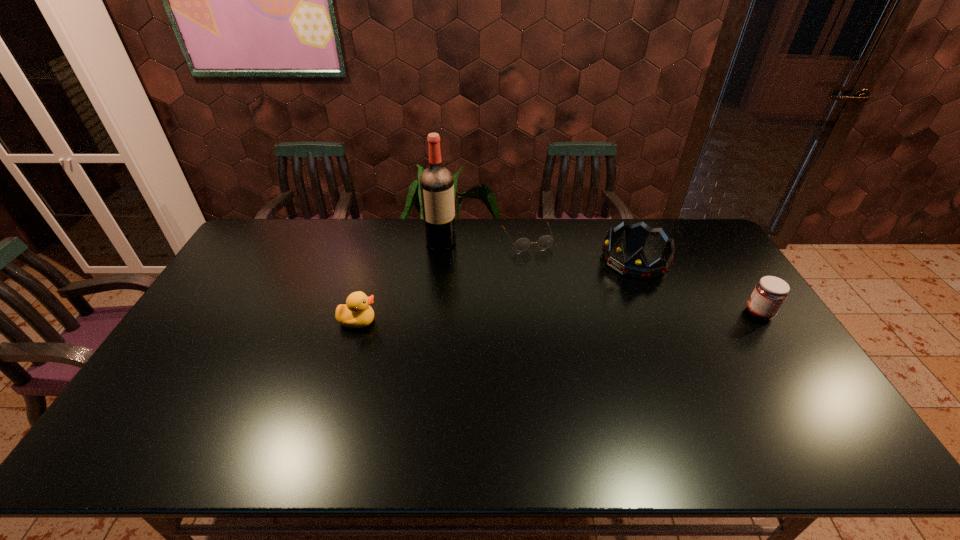
Identify the location of spectacles located at the far edge. (522, 244).

The image size is (960, 540). I want to click on liquor located at the far edge, so click(436, 182).

This screenshot has width=960, height=540. What are the coordinates of `object located in the right edge section of the desktop` in the screenshot? It's located at (770, 292).

You are a GUI agent. You are given a task and a screenshot of the screen. Output one action in this format:
    pyautogui.click(x=<x>, y=<y>)
    Task: Click on the free space at the far edge of the desktop
    Image resolution: width=960 pixels, height=540 pixels.
    Given the screenshot: What is the action you would take?
    pyautogui.click(x=372, y=227)

Locate an element on the screen. Image resolution: width=960 pixels, height=540 pixels. free region at the near edge is located at coordinates (518, 411).

I want to click on free space at the left edge of the desktop, so click(x=186, y=340).

Locate an element on the screen. This screenshot has height=540, width=960. vacant position at the right edge of the desktop is located at coordinates (691, 261).

This screenshot has width=960, height=540. What are the coordinates of `vacant space at the far left corner of the desktop` in the screenshot? It's located at pos(258,255).

I want to click on free space at the far right corner of the desktop, so pos(684,242).

Find the location of `free space between the duckling and the rightmost object`. free space between the duckling and the rightmost object is located at coordinates (559, 317).